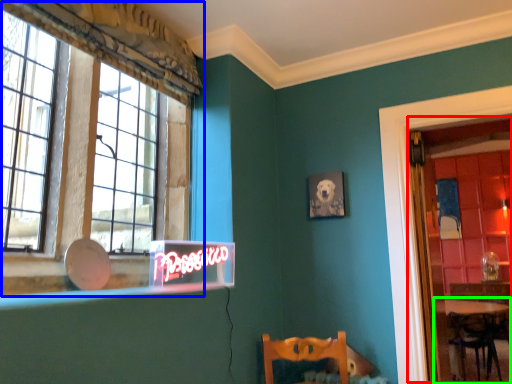
Question: Which object is the farthest from glass door (highlighted by a red box)? Choose among these: window (highlighted by a blue box) or table (highlighted by a green box).

Choices:
 (A) window
 (B) table

Answer: (A)